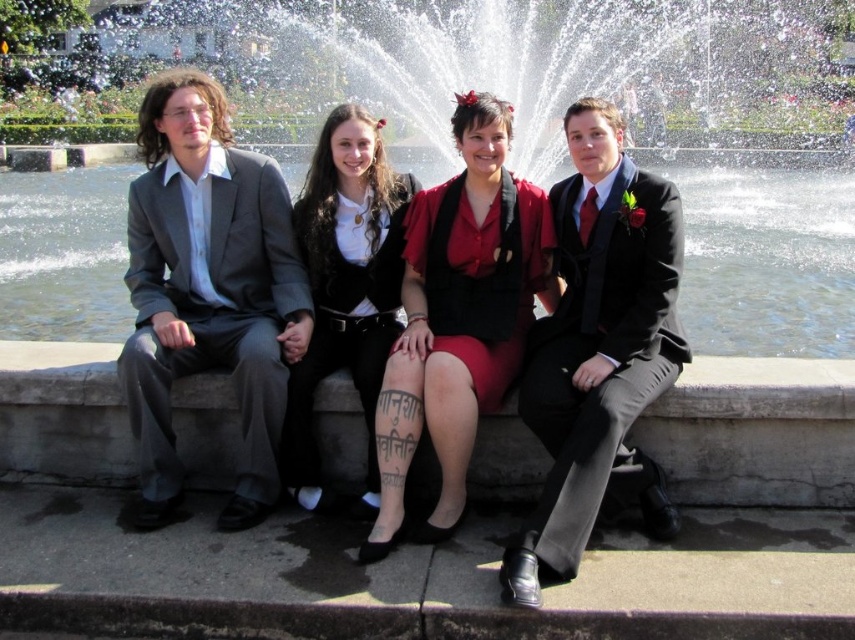
Can you confirm if matte gray suit at left is wider than shiny black suit at center?

Yes.

Between point (167, 381) and point (664, 188), which one is positioned behind?

The point (664, 188) is more distant.

Which is in front, point (186, 90) or point (602, 333)?

Point (602, 333) is more forward.

This screenshot has height=640, width=855. Identify the location of matte gray suit at left. (207, 291).

Is point (470, 29) positioned after point (526, 298)?

Yes.

Is point (809, 276) farther from viewer compared to point (463, 234)?

Yes.

The image size is (855, 640). What are the coordinates of `clear glass water at center` in the screenshot? It's located at (618, 104).

Who is positioned more to the right, matte gray suit at left or matte red skirt at center?

matte red skirt at center

Which is behind, point (204, 234) or point (466, 192)?

The point (466, 192) is more distant.

You are a GUI agent. You are given a task and a screenshot of the screen. Output one action in this format:
    pyautogui.click(x=<x>, y=<y>)
    Task: Click on the matte gray suit at left
    The height and width of the screenshot is (640, 855).
    Given the screenshot: What is the action you would take?
    pyautogui.click(x=207, y=291)